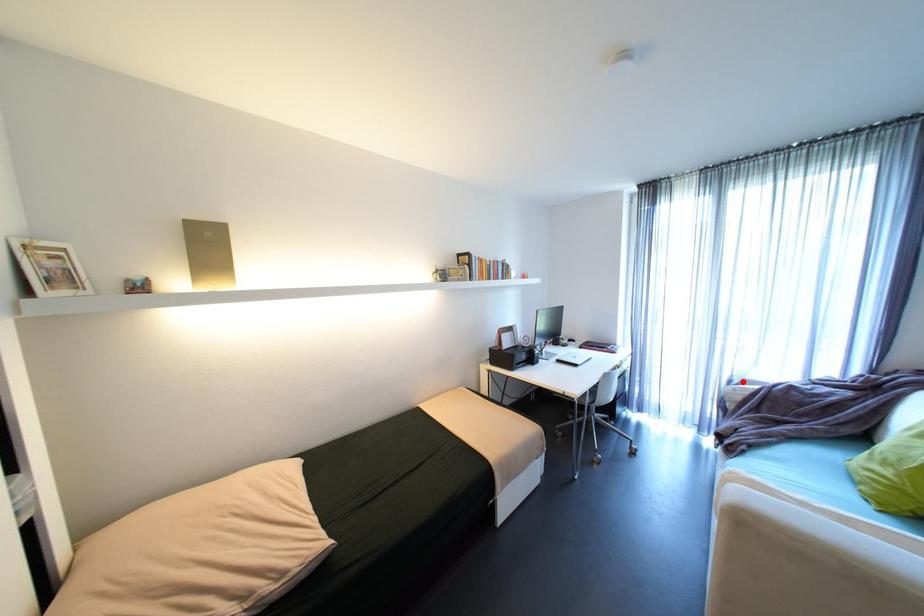
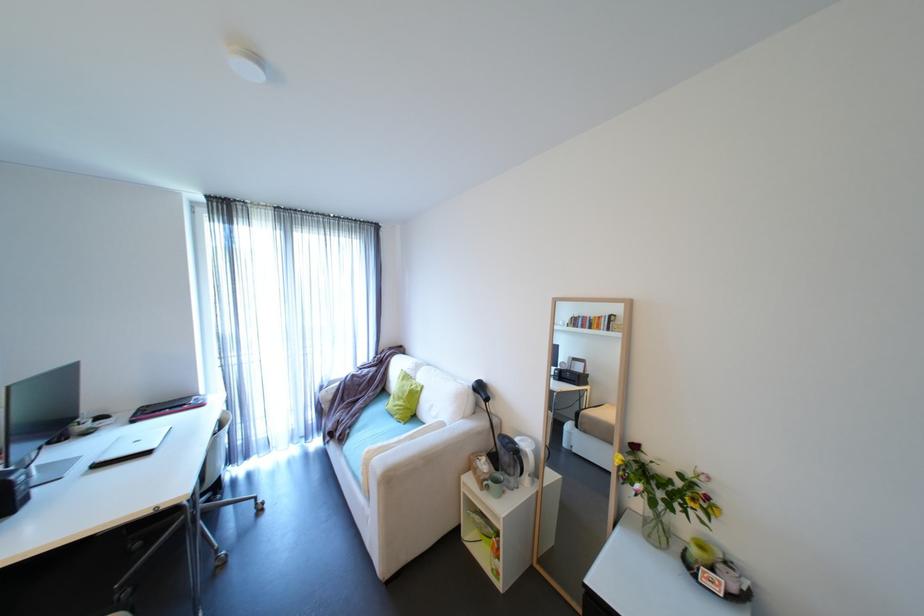
Question: I am providing you with two images of the same scene from different viewpoints. A red point is marked on the first image. Can you still see the location of the red point in image 2?

Choices:
 (A) Yes
 (B) No

Answer: (A)